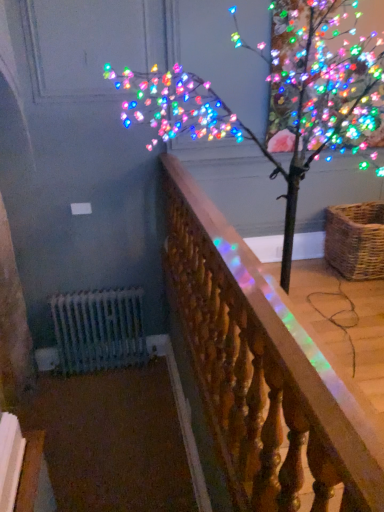
This screenshot has height=512, width=384. What do you see at coordinates (356, 240) in the screenshot? I see `woven brown basket at right` at bounding box center [356, 240].

You are a GUI agent. You are given a task and a screenshot of the screen. Output one action in this format:
    pyautogui.click(x=<x>, y=<y>)
    Task: Click on the woven brown basket at right
    The width and height of the screenshot is (384, 512).
    Given the screenshot: What is the action you would take?
    pyautogui.click(x=356, y=240)

Describe the element at coordinates (263, 371) in the screenshot. This screenshot has height=512, width=384. I see `iridescent wood railing at center` at that location.

Where is `iridescent wood railing at center`? Image resolution: width=384 pixels, height=512 pixels. iridescent wood railing at center is located at coordinates (263, 371).

Locate an element on the screen. woven brown basket at right is located at coordinates (356, 240).

Between iridescent wood railing at center and woven brown basket at right, which one appears on the right side from the viewer's perspective?

woven brown basket at right.

Is iridescent wood railing at center closer to camera compared to woven brown basket at right?

Yes.

Between point (379, 468) and point (364, 207), which one is positioned in front?

The point (379, 468) is closer.

From the image's perspective, is iridescent wood railing at center positioned above or below woven brown basket at right?

From the image's perspective, iridescent wood railing at center appears below woven brown basket at right.

From a real-world perspective, between iridescent wood railing at center and woven brown basket at right, who is vertically higher?

From a 3D spatial view, iridescent wood railing at center is above.

Considering the sizes of objects iridescent wood railing at center and woven brown basket at right in the image provided, who is wider, iridescent wood railing at center or woven brown basket at right?

With larger width is woven brown basket at right.

Is iridescent wood railing at center taller than woven brown basket at right?

Correct, iridescent wood railing at center is much taller as woven brown basket at right.

Considering the relative sizes of iridescent wood railing at center and woven brown basket at right in the image provided, is iridescent wood railing at center smaller than woven brown basket at right?

No.

Is woven brown basket at right a part of iridescent wood railing at center?

Result: Definitely not — woven brown basket at right is not inside iridescent wood railing at center.

Is iridescent wood railing at center far from woven brown basket at right?

iridescent wood railing at center is far away from woven brown basket at right.

Is iridescent wood railing at center facing away from woven brown basket at right?

No, woven brown basket at right is not at the back of iridescent wood railing at center.

How different are the orientations of iridescent wood railing at center and woven brown basket at right in degrees?

There is a 1.46-degree angle between the facing directions of iridescent wood railing at center and woven brown basket at right.

Identify the location of basket located on the right of iridescent wood railing at center. Image resolution: width=384 pixels, height=512 pixels. (356, 240).

Between woven brown basket at right and iridescent wood railing at center, which one appears on the left side from the viewer's perspective?

Positioned to the left is iridescent wood railing at center.

Which object is further away from the camera, woven brown basket at right or iridescent wood railing at center?

woven brown basket at right is further from the camera.

Between point (327, 230) and point (295, 459), which one is positioned in front?

The point (295, 459) is closer to the camera.

From the image's perspective, is woven brown basket at right above iridescent wood railing at center?

Yes, from the image's perspective, woven brown basket at right is above iridescent wood railing at center.

From a real-world perspective, is woven brown basket at right positioned above or below iridescent wood railing at center?

From a real-world perspective, woven brown basket at right is physically below iridescent wood railing at center.

Does woven brown basket at right have a lesser width compared to iridescent wood railing at center?

Incorrect, the width of woven brown basket at right is not less than that of iridescent wood railing at center.

Which of these two, woven brown basket at right or iridescent wood railing at center, stands shorter?

With less height is woven brown basket at right.

Is woven brown basket at right smaller than iridescent wood railing at center?

Yes, woven brown basket at right is smaller than iridescent wood railing at center.

Would you say woven brown basket at right is outside iridescent wood railing at center?

Absolutely, woven brown basket at right is external to iridescent wood railing at center.

Are woven brown basket at right and iridescent wood railing at center beside each other?

No, woven brown basket at right is not making contact with iridescent wood railing at center.

Is woven brown basket at right looking in the opposite direction of iridescent wood railing at center?

Yes, woven brown basket at right is facing away from iridescent wood railing at center.

How distant is woven brown basket at right from iridescent wood railing at center?

The distance of woven brown basket at right from iridescent wood railing at center is 4.97 feet.

Image resolution: width=384 pixels, height=512 pixels. In order to click on basket below the iridescent wood railing at center (from a real-world perspective) in this screenshot , I will do `click(356, 240)`.

The width and height of the screenshot is (384, 512). I want to click on rail in front of the woven brown basket at right, so click(x=263, y=371).

The image size is (384, 512). Identify the location of basket behind the iridescent wood railing at center. (356, 240).